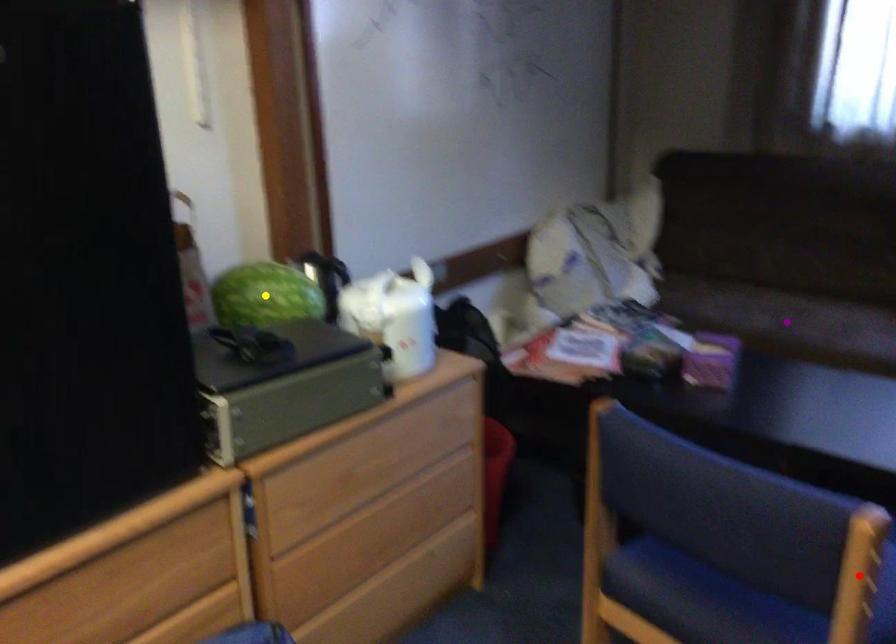
Order these from nearest to farthest:
- yellow point
- red point
- purple point

red point
yellow point
purple point